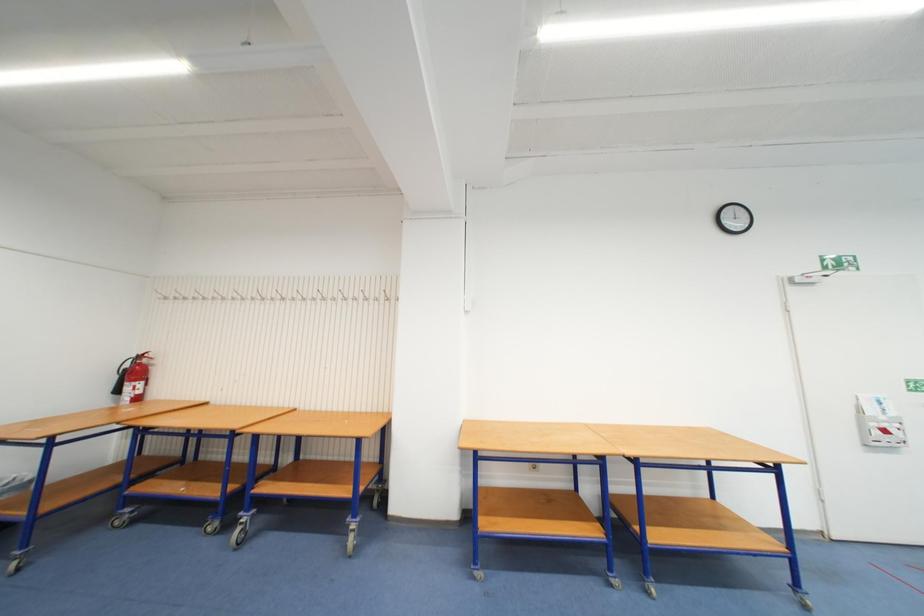
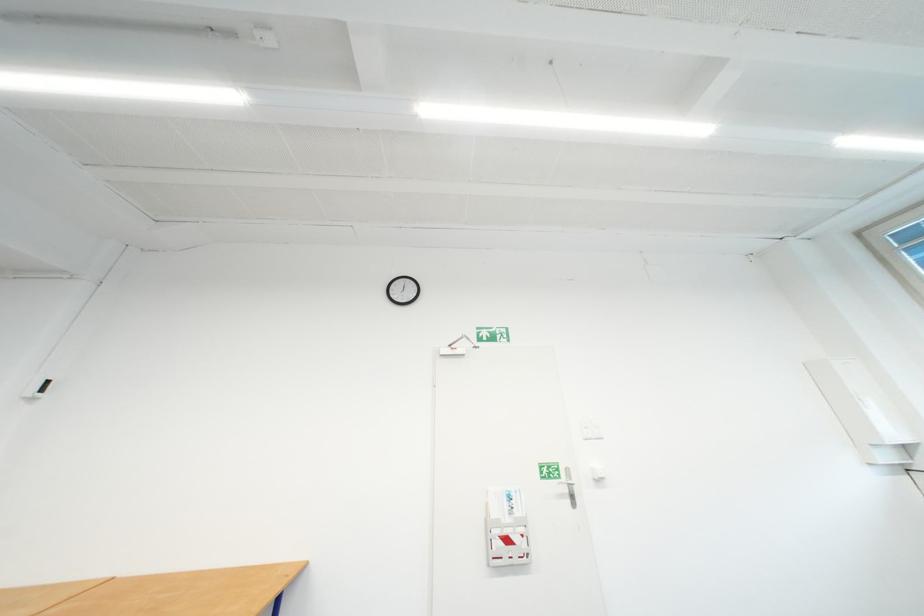
Question: What movement of the cameraman would produce the second image?

Choices:
 (A) Left
 (B) Right
 (C) Forward
 (D) Backward

Answer: (B)